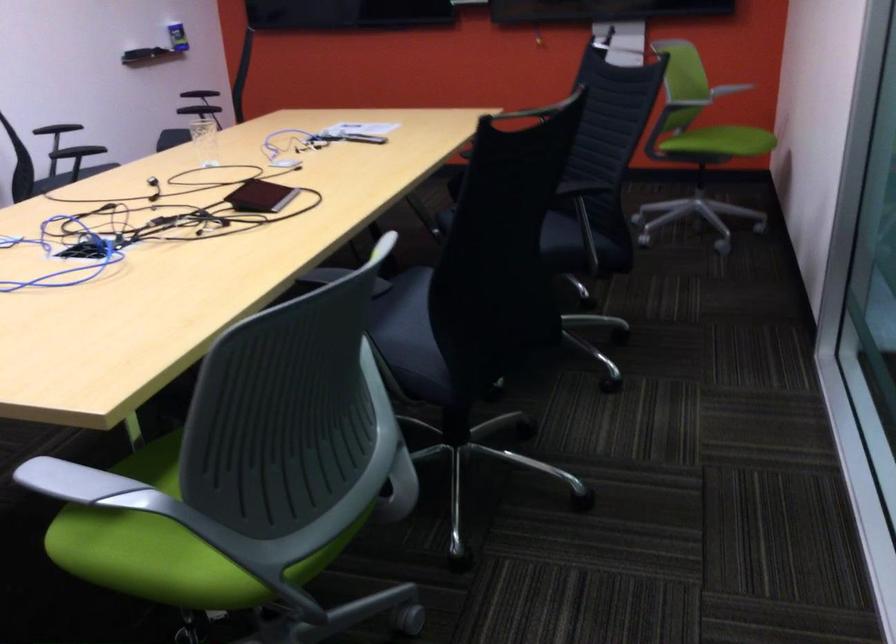
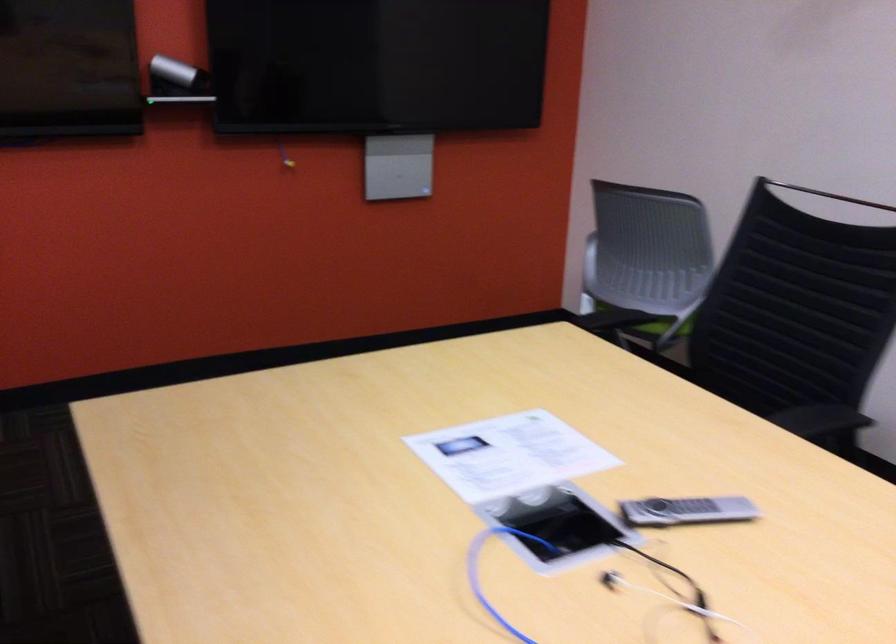
The point at [314,143] is marked in the first image. Where is the corresponding point in the second image?

(576, 583)